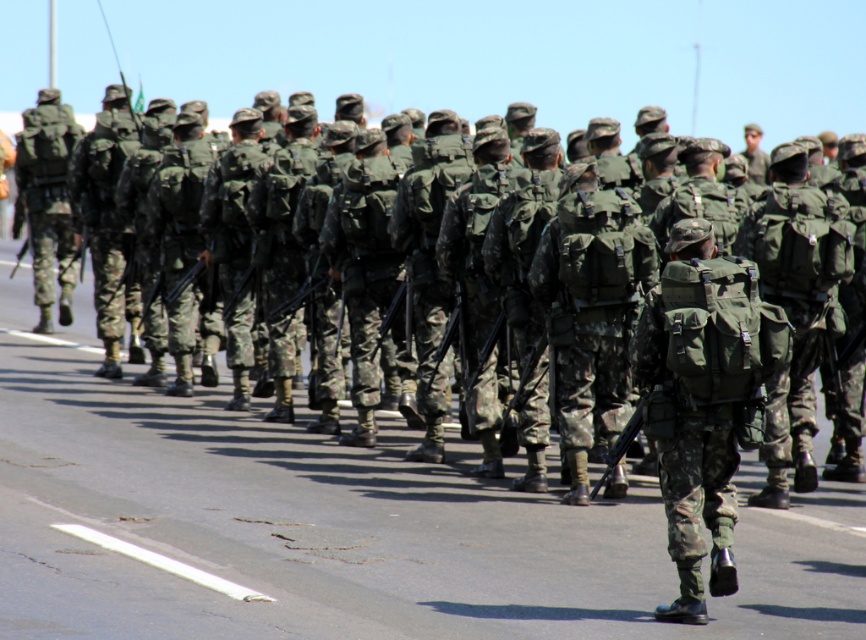
Question: Is camo fabric backpack at center below matte green backpack at center-right?

Choices:
 (A) yes
 (B) no

Answer: (A)

Question: Which of the following is the farthest from the observer?

Choices:
 (A) (838, 209)
 (B) (621, 189)

Answer: (A)

Question: Among these points, which one is nearest to the camera?

Choices:
 (A) (785, 358)
 (B) (173, 572)
 (C) (726, 433)
 (D) (576, 308)

Answer: (C)

Question: Is camo fabric backpack at center below matte green backpack at center-right?

Choices:
 (A) yes
 (B) no

Answer: (A)

Question: Which of the following is the farthest from the observer?

Choices:
 (A) matte green backpack at center-right
 (B) white asphalt at lower left
 (C) camouflage fabric backpack at center

Answer: (A)

Question: Is camo fabric backpack at center below matte green backpack at center-right?

Choices:
 (A) no
 (B) yes

Answer: (B)